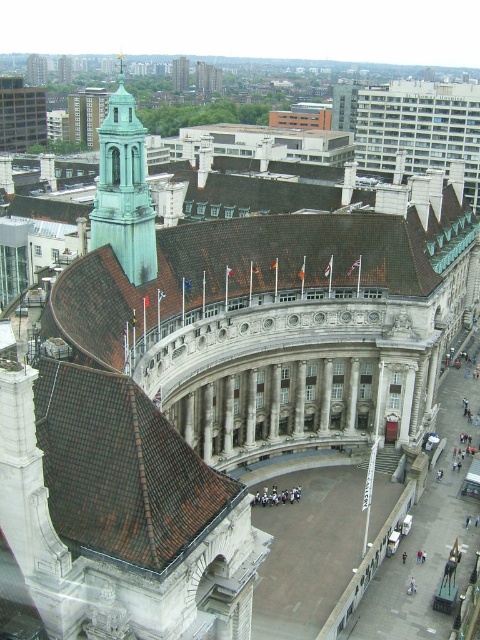
Question: Is green copper bell tower at upper left thinner than green copper tower at upper left?

Choices:
 (A) yes
 (B) no

Answer: (B)

Question: Which point appears closest to the camera in this image?

Choices:
 (A) (132, 524)
 (B) (59, 81)
 (C) (28, 83)
 (D) (186, 72)

Answer: (A)

Question: Which point appears closest to the camera in this image?

Choices:
 (A) (33, 70)
 (B) (126, 216)
 (C) (71, 77)

Answer: (B)

Question: Is green stone tower at upper left to the left of green copper tower at upper left from the viewer's perspective?

Choices:
 (A) no
 (B) yes

Answer: (B)

Question: Does green copper tower at upper left appear on the right side of green copper spire at upper left?

Choices:
 (A) no
 (B) yes

Answer: (B)

Question: Which of the following is the closest to the observer?

Choices:
 (A) (162, 547)
 (B) (38, 68)
 (C) (108, 228)
 (D) (175, 90)

Answer: (A)